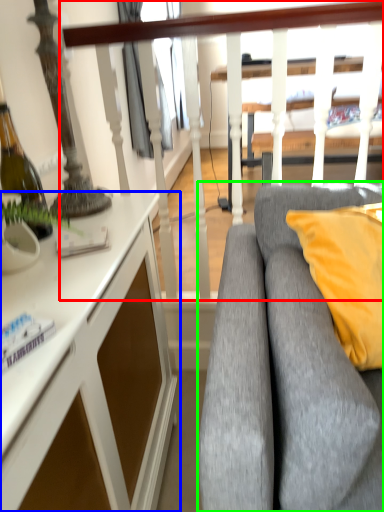
Question: Estimate the real-world distances between objects in this image. Which object is closer to rail (highlighted by a red box), desk (highlighted by a blue box) or studio couch (highlighted by a green box)?

Choices:
 (A) desk
 (B) studio couch

Answer: (B)